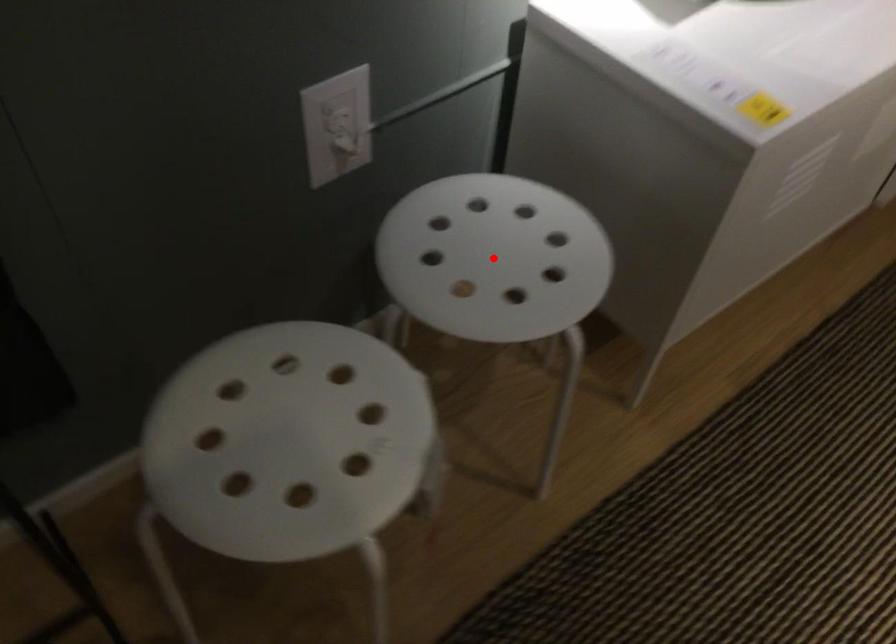
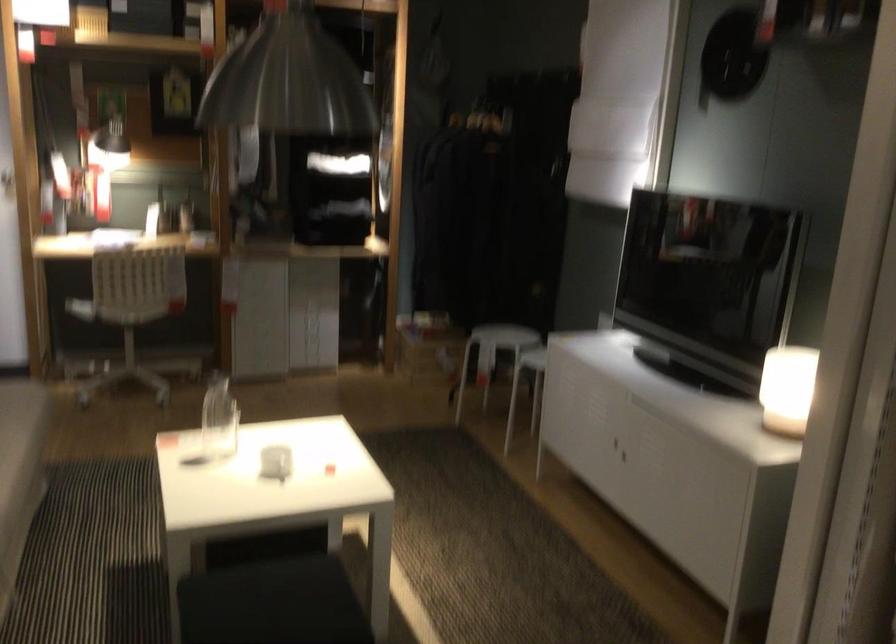
Question: I am providing you with two images of the same scene from different viewpoints. A red point is marked on the first image. Can you still see the location of the red point in image 2?

Choices:
 (A) Yes
 (B) No

Answer: (B)